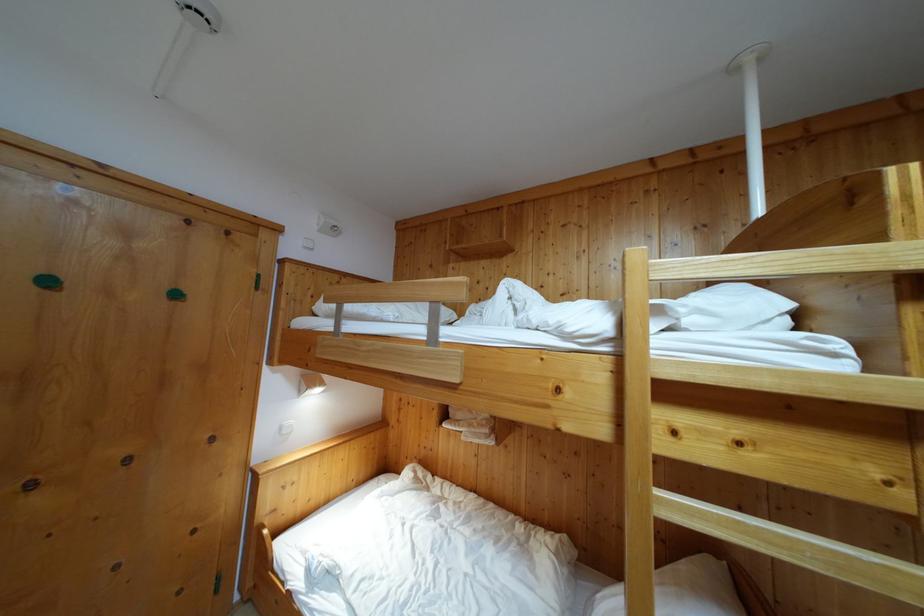
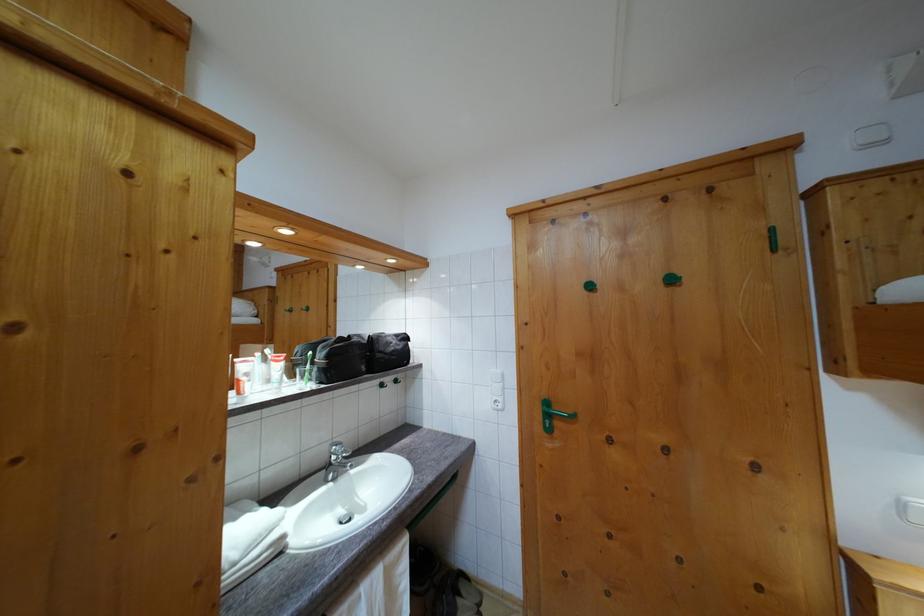
Locate, in the second image, the point that corresponds to the point at 179,302 in the first image.

(675, 286)